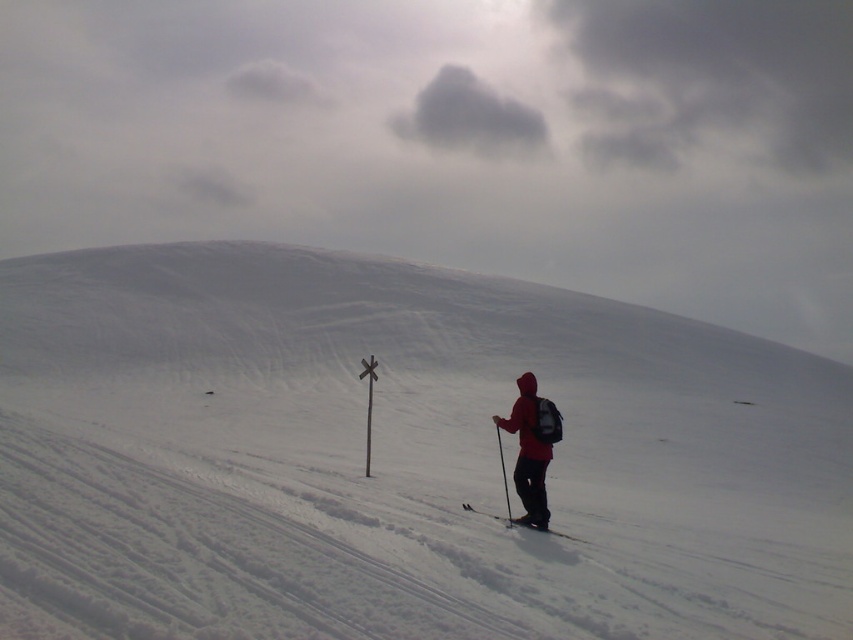
Looking at this image, you are a skier planning to take a photo of the matte red jacket at lower right and the gray fluffy cloud at upper center. Which object will appear larger in the photo?

The matte red jacket at lower right will appear larger in the photo because it is closer to the viewer than the gray fluffy cloud at upper center.

You are a skier preparing to descend the slope and notice the gray fluffy cloud at upper center and the matte black ski at lower right. Which object is located more to the left in the scene?

The gray fluffy cloud at upper center is positioned more to the left than the matte black ski at lower right.

From the picture: You are planning to take a photo of the dark gray cloud at upper center and the gray fluffy cloud at upper center in the snowy landscape. Which cloud is positioned higher in the sky?

The dark gray cloud at upper center is taller than the gray fluffy cloud at upper center, so it is positioned higher in the sky.